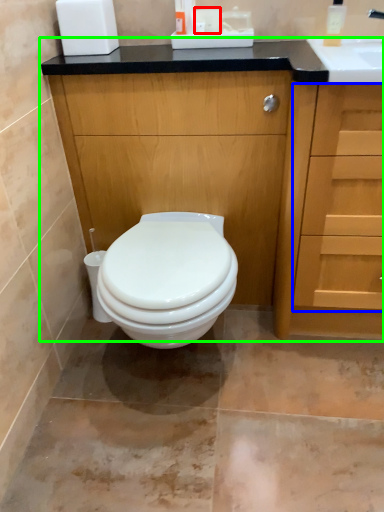
Question: Based on their relative distances, which object is farther from toilet paper (highlighted by a red box)? Choose from drawer (highlighted by a blue box) and bathroom cabinet (highlighted by a green box).

Choices:
 (A) drawer
 (B) bathroom cabinet

Answer: (A)